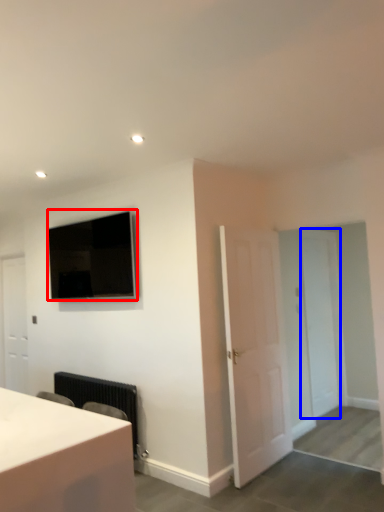
Question: Which point is closer to the camera, television (highlighted by a red box) or door (highlighted by a blue box)?

Choices:
 (A) television
 (B) door

Answer: (A)